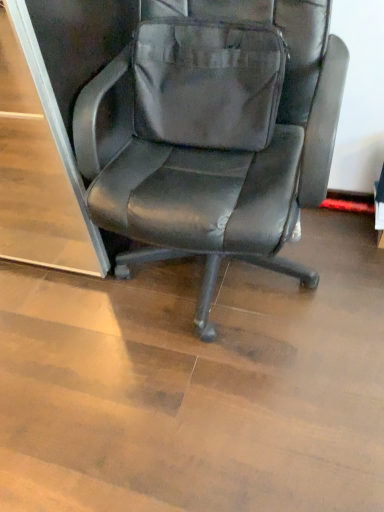
Identify the location of matte gray messenger bag at center. Image resolution: width=384 pixels, height=512 pixels. (208, 82).

This screenshot has height=512, width=384. Describe the element at coordinates (208, 82) in the screenshot. I see `matte gray messenger bag at center` at that location.

Image resolution: width=384 pixels, height=512 pixels. What do you see at coordinates (215, 131) in the screenshot?
I see `black leather chair at center` at bounding box center [215, 131].

In order to face black leather chair at center, should I rotate leftwards or rightwards?

You should look right and rotate roughly 4.156 degrees.

Identify the location of black leather chair at center. Image resolution: width=384 pixels, height=512 pixels. (215, 131).

Identify the location of matte gray messenger bag at center. (208, 82).

Which object is positioned more to the right, matte gray messenger bag at center or black leather chair at center?

From the viewer's perspective, black leather chair at center appears more on the right side.

Is matte gray messenger bag at center behind black leather chair at center?

Yes, the depth of matte gray messenger bag at center is greater than that of black leather chair at center.

Which point is more distant from viewer, (243, 138) or (335, 49)?

Point (243, 138)

From the image's perspective, is matte gray messenger bag at center located beneath black leather chair at center?

Actually, matte gray messenger bag at center appears above black leather chair at center in the image.

From a real-world perspective, which object rests below the other?

In real-world perspective, black leather chair at center is lower.

Between matte gray messenger bag at center and black leather chair at center, which one has larger width?

black leather chair at center.

Considering the sizes of objects matte gray messenger bag at center and black leather chair at center in the image provided, who is shorter, matte gray messenger bag at center or black leather chair at center?

With less height is matte gray messenger bag at center.

Can you confirm if matte gray messenger bag at center is bigger than black leather chair at center?

Incorrect, matte gray messenger bag at center is not larger than black leather chair at center.

In the scene shown: Is matte gray messenger bag at center positioned beyond the bounds of black leather chair at center?

No, matte gray messenger bag at center is not entirely external to black leather chair at center.

Is matte gray messenger bag at center touching black leather chair at center?

Yes.

Is matte gray messenger bag at center positioned with its back to black leather chair at center?

Yes.

How much distance is there between matte gray messenger bag at center and black leather chair at center?

The distance of matte gray messenger bag at center from black leather chair at center is 7.75 centimeters.

Find the location of a particular element. The width and height of the screenshot is (384, 512). chair located underneath the matte gray messenger bag at center (from a real-world perspective) is located at coordinates (215, 131).

Between black leather chair at center and matte gray messenger bag at center, which one appears on the right side from the viewer's perspective?

Positioned to the right is black leather chair at center.

Is black leather chair at center positioned in front of matte gray messenger bag at center?

That is True.

Does point (278, 27) appear closer or farther from the camera than point (155, 131)?

Point (278, 27) is positioned closer to the camera compared to point (155, 131).

Based on the photo, from the image's perspective, is black leather chair at center located beneath matte gray messenger bag at center?

Yes, from the image's perspective, black leather chair at center is below matte gray messenger bag at center.

From a real-world perspective, is black leather chair at center above or below matte gray messenger bag at center?

In terms of real-world spatial position, black leather chair at center is below matte gray messenger bag at center.

Is black leather chair at center thinner than matte gray messenger bag at center?

No.

Which of these two, black leather chair at center or matte gray messenger bag at center, stands taller?

Standing taller between the two is black leather chair at center.

Considering the relative sizes of black leather chair at center and matte gray messenger bag at center in the image provided, is black leather chair at center smaller than matte gray messenger bag at center?

Actually, black leather chair at center might be larger than matte gray messenger bag at center.

Is black leather chair at center spatially inside matte gray messenger bag at center, or outside of it?

The correct answer is: outside.

In the scene shown: Is the surface of black leather chair at center in direct contact with matte gray messenger bag at center?

Yes, the surface of black leather chair at center is in contact with matte gray messenger bag at center.

Is black leather chair at center turned away from matte gray messenger bag at center?

Yes.

Identify the location of chair on the right of matte gray messenger bag at center. (x=215, y=131).

The width and height of the screenshot is (384, 512). Find the location of `messenger bag located above the black leather chair at center (from a real-world perspective)`. messenger bag located above the black leather chair at center (from a real-world perspective) is located at coordinates (208, 82).

Where is `messenger bag that is behind the black leather chair at center`? The height and width of the screenshot is (512, 384). messenger bag that is behind the black leather chair at center is located at coordinates tap(208, 82).